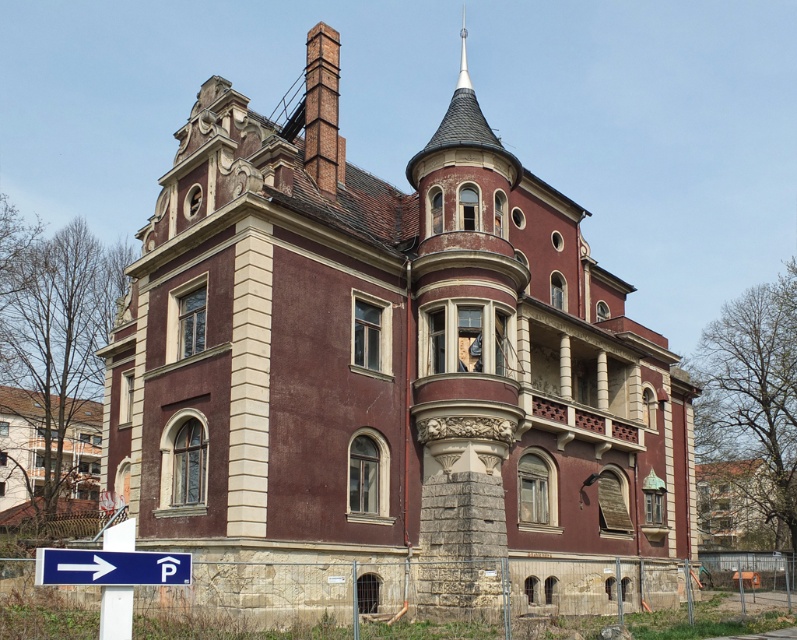
Question: Where is maroon stone mansion at center located in relation to blue plastic arrow at lower left in the image?

Choices:
 (A) right
 (B) left

Answer: (A)

Question: Which point is farther to the camera?

Choices:
 (A) (426, 147)
 (B) (61, 468)

Answer: (A)

Question: Is rustic stone mansion at upper left below blue plastic arrow at lower left?

Choices:
 (A) yes
 (B) no

Answer: (A)

Question: Among these objects, which one is nearest to the camera?

Choices:
 (A) maroon stone mansion at center
 (B) blue plastic arrow at lower left
 (C) rustic stone mansion at upper left

Answer: (B)

Question: Which object is positioned farthest from the maroon stone mansion at center?

Choices:
 (A) rustic stone mansion at upper left
 (B) blue plastic arrow at lower left

Answer: (A)

Question: In this image, where is maroon stone mansion at center located relative to rustic stone mansion at upper left?

Choices:
 (A) right
 (B) left

Answer: (A)